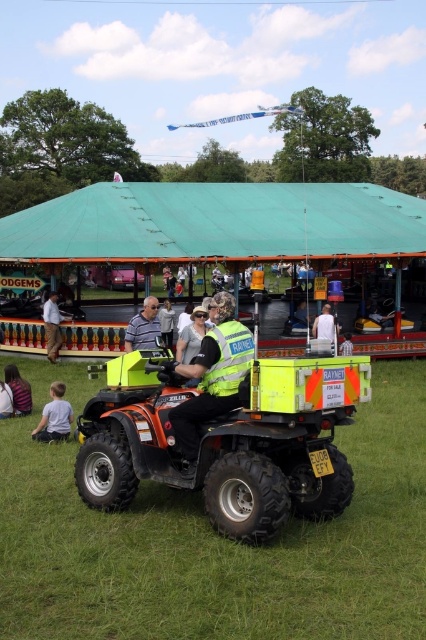
You are a photographer at the carnival and want to take a photo of the striped fabric shirt at lower left and orange matte quad bike at center. Based on their positions, which object is located to the right side of the other?

The striped fabric shirt at lower left is to the right of orange matte quad bike at center.

What is the position of the point at coordinates (x=17, y=390) in the image?

The point at coordinates (x=17, y=390) is located on the striped fabric shirt at lower left.